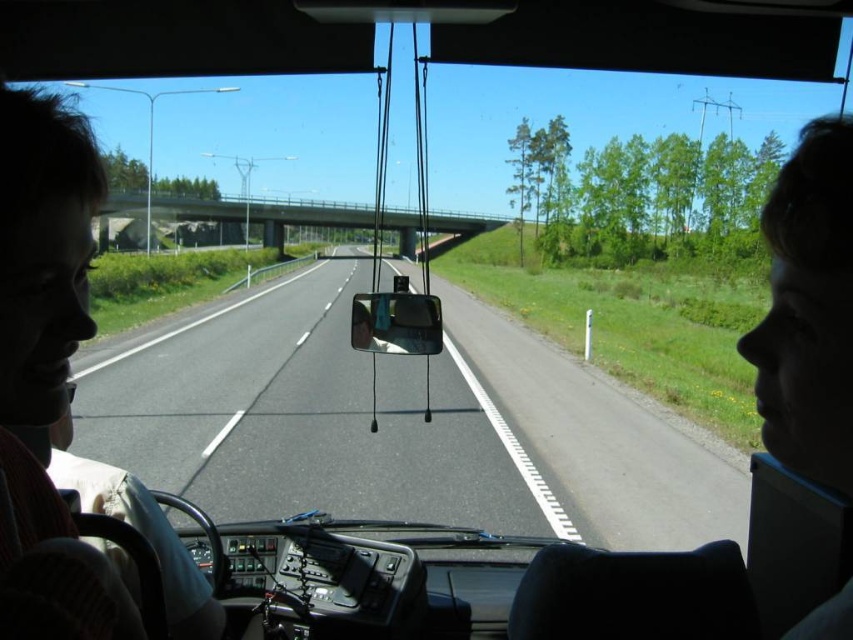
Question: In this image, where is matte black hair at left located relative to matte white face at center?

Choices:
 (A) right
 (B) left

Answer: (B)

Question: Among these objects, which one is farthest from the camera?

Choices:
 (A) clear glass view mirror at center
 (B) asphalt road at center

Answer: (B)

Question: Which point appears farthest from the camera in this image?

Choices:
 (A) (64, 250)
 (B) (409, 349)
 (C) (390, 337)
 (D) (425, 483)

Answer: (D)

Question: Which object appears farthest from the camera in this image?

Choices:
 (A) asphalt road at center
 (B) clear glass view mirror at center
 (C) matte white face at center

Answer: (A)

Question: Considering the relative positions of matte black hair at left and clear glass view mirror at center in the image provided, where is matte black hair at left located with respect to clear glass view mirror at center?

Choices:
 (A) above
 (B) below

Answer: (B)

Question: Where is asphalt road at center located in relation to clear glass view mirror at center in the image?

Choices:
 (A) below
 (B) above

Answer: (A)